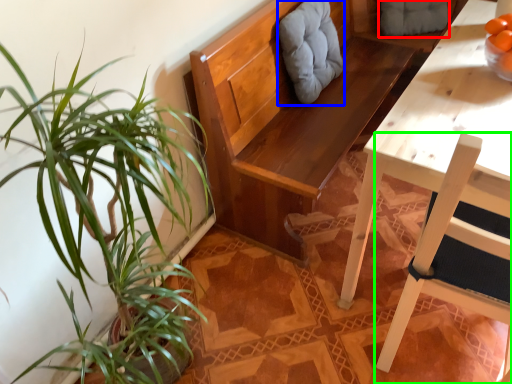
Question: Which object is the farthest from swivel chair (highlighted by a red box)? Choose among these: swivel chair (highlighted by a blue box) or chair (highlighted by a green box).

Choices:
 (A) swivel chair
 (B) chair

Answer: (B)